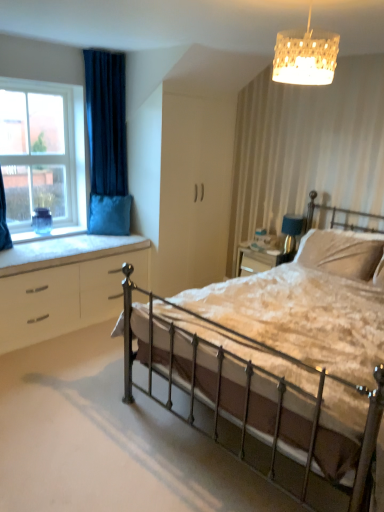
Question: Considering the positions of white textured lampshade at upper center and velvet blue pillow at window, placed as the 2th pillow when sorted from front to back, in the image, is white textured lampshade at upper center taller or shorter than velvet blue pillow at window, placed as the 2th pillow when sorted from front to back,?

Choices:
 (A) short
 (B) tall

Answer: (A)

Question: From the image's perspective, relative to velvet blue pillow at window, the first pillow in the back-to-front sequence, is white textured lampshade at upper center above or below?

Choices:
 (A) below
 (B) above

Answer: (B)

Question: Which object is positioned farthest from the velvet beige pillow at center, the first pillow from the front?

Choices:
 (A) velvet blue pillow at window, the first pillow in the back-to-front sequence
 (B) white glossy chest of drawers at lower left
 (C) clear glass window at left
 (D) metallic iron bed at center
 (E) blue fabric table lamp at right

Answer: (C)

Question: Which is farther from the white glossy chest of drawers at lower left?

Choices:
 (A) velvet beige pillow at center, the 2th pillow when ordered from back to front
 (B) white textured lampshade at upper center
 (C) velvet blue pillow at window, placed as the 2th pillow when sorted from front to back
 (D) metallic iron bed at center
 (E) blue fabric table lamp at right

Answer: (B)